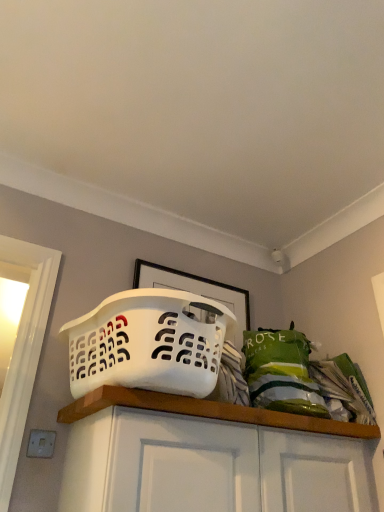
Question: Considering their positions, is white matte cabinet at center located in front of or behind white plastic laundry basket at center?

Choices:
 (A) front
 (B) behind

Answer: (A)

Question: From the image's perspective, is white matte cabinet at center above or below white plastic laundry basket at center?

Choices:
 (A) below
 (B) above

Answer: (A)

Question: Based on their positions, is white matte cabinet at center located to the left or right of white plastic laundry basket at center?

Choices:
 (A) left
 (B) right

Answer: (B)

Question: Is white plastic laundry basket at center wider or thinner than white matte cabinet at center?

Choices:
 (A) wide
 (B) thin

Answer: (A)

Question: From a real-world perspective, is white plastic laundry basket at center positioned above or below white matte cabinet at center?

Choices:
 (A) below
 (B) above

Answer: (B)

Question: Based on their sizes in the image, would you say white plastic laundry basket at center is bigger or smaller than white matte cabinet at center?

Choices:
 (A) small
 (B) big

Answer: (B)

Question: In the image, is white plastic laundry basket at center positioned in front of or behind white matte cabinet at center?

Choices:
 (A) front
 (B) behind

Answer: (B)